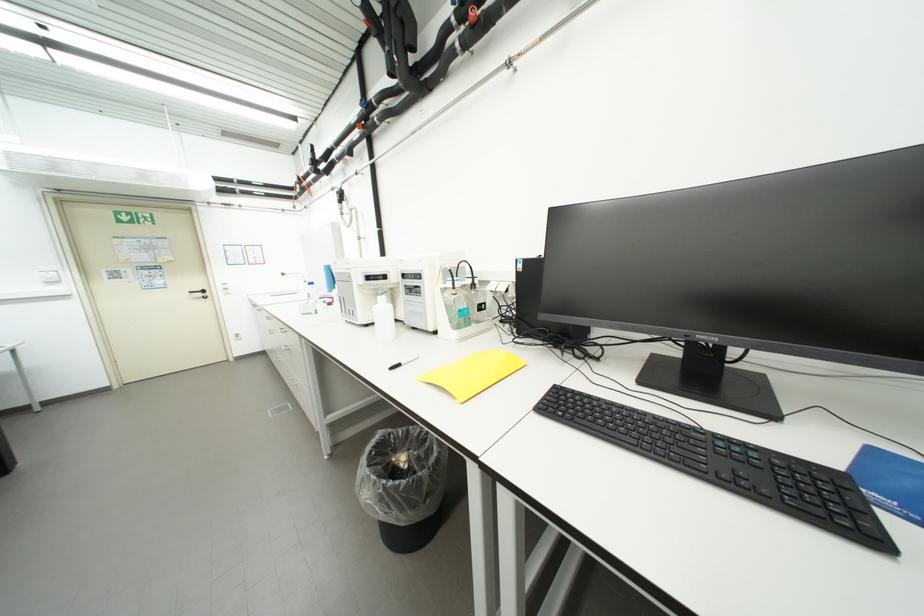
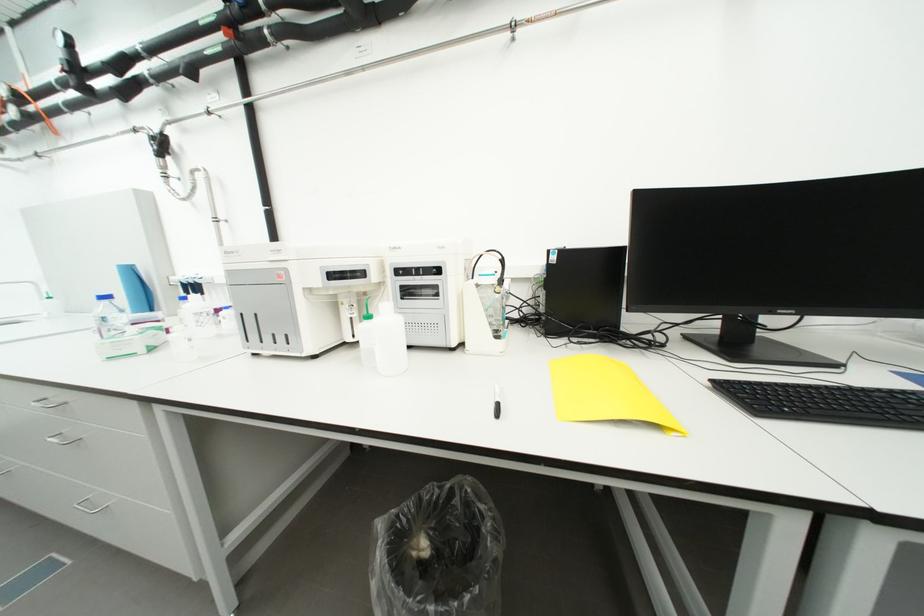
Question: How did the camera likely rotate?

Choices:
 (A) Left
 (B) Right
 (C) Up
 (D) Down

Answer: (B)